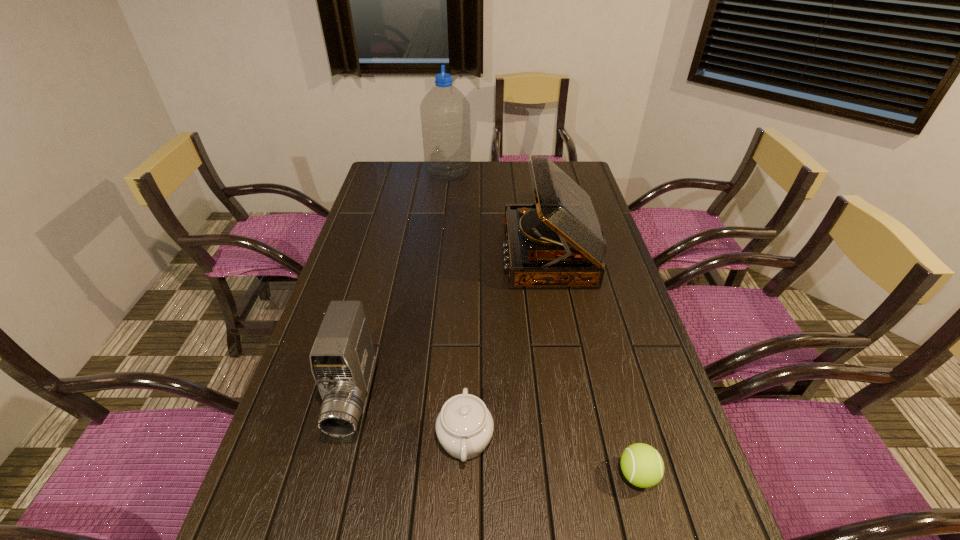
This screenshot has width=960, height=540. In order to click on the tallest object in this screenshot , I will do `click(445, 112)`.

In order to click on water jug in this screenshot , I will do `click(445, 112)`.

Image resolution: width=960 pixels, height=540 pixels. What are the coordinates of `the second tallest object` in the screenshot? It's located at (558, 242).

Identify the location of record player. The width and height of the screenshot is (960, 540). (558, 242).

Where is `the third shortest object`? the third shortest object is located at coordinates (342, 358).

The image size is (960, 540). I want to click on the leftmost object, so click(x=342, y=358).

The image size is (960, 540). I want to click on the fourth tallest object, so click(x=464, y=427).

In order to click on tennis ball in this screenshot , I will do `click(642, 465)`.

Where is `vacant space located on the front of the water jug`? This screenshot has width=960, height=540. vacant space located on the front of the water jug is located at coordinates (444, 218).

The image size is (960, 540). What are the coordinates of `vacant position located on the front-facing side of the record player` in the screenshot? It's located at (440, 253).